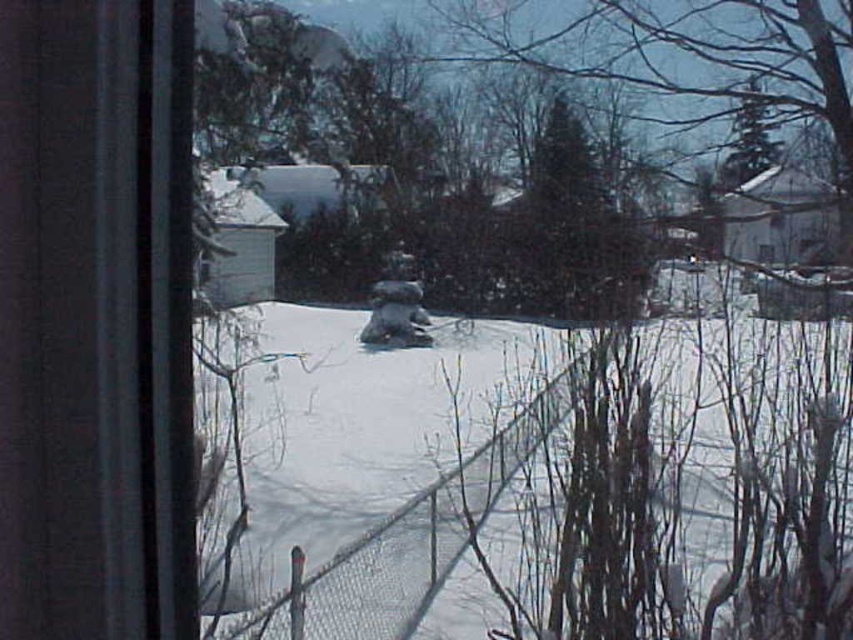
You are an interior designer assessing the view from a new office. You notice the transparent glass window at left and the metal mesh fence at center. Which object is shorter in height?

The transparent glass window at left is shorter in height than the metal mesh fence at center because the description states that the transparent glass window at left is not as tall as metal mesh fence at center.

You are an interior designer assessing the view from inside a room. You notice the transparent glass window at left and the metal mesh fence at center. Which object has a smaller width from your perspective?

The transparent glass window at left has a lesser width compared to the metal mesh fence at center, so the transparent glass window at left is smaller in width.

You are standing inside the building looking through the window. You see two points marked on the window glass at coordinates point (21, 595) and point (399, 602). Which of these points appears closer to your eyes when looking through the window?

Point (21, 595) appears closer to your eyes because it is closer to the camera than point (399, 602).